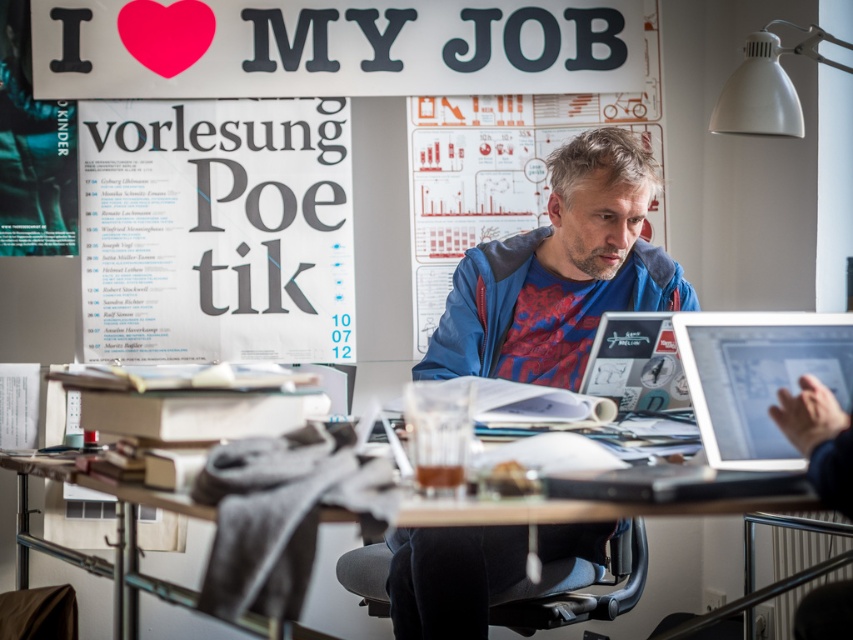
Can you confirm if matte paper poster at center is shorter than silver metallic laptop at center?

No, matte paper poster at center is not shorter than silver metallic laptop at center.

Is matte paper poster at center bigger than silver metallic laptop at center?

Yes.

Between point (463, 172) and point (770, 339), which one is positioned in front?

Point (770, 339) is in front.

Where is `matte paper poster at center`? The width and height of the screenshot is (853, 640). matte paper poster at center is located at coordinates (490, 173).

What do you see at coordinates (560, 273) in the screenshot? I see `blue fleece jacket at center` at bounding box center [560, 273].

Does point (395, 556) come behind point (792, 116)?

That is False.

I want to click on blue fleece jacket at center, so click(x=560, y=273).

The height and width of the screenshot is (640, 853). Describe the element at coordinates (216, 228) in the screenshot. I see `white paper poster at upper left` at that location.

Is white paper poster at upper left thinner than silver metallic laptop at center?

In fact, white paper poster at upper left might be wider than silver metallic laptop at center.

Does point (294, 280) come behind point (705, 380)?

That is True.

Locate an element on the screen. white paper poster at upper left is located at coordinates (216, 228).